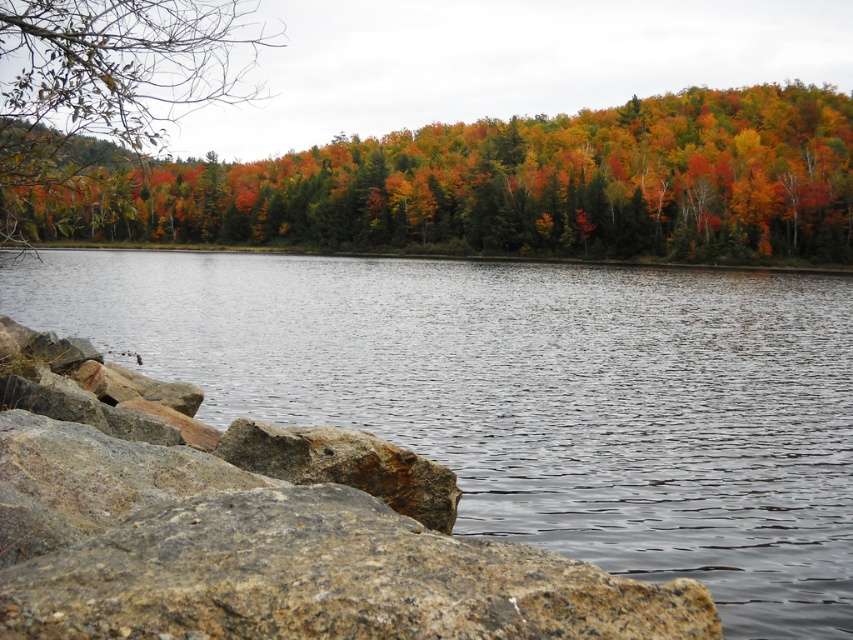
Does point (602, 531) lie in front of point (700, 616)?

No, it is not.

The height and width of the screenshot is (640, 853). Describe the element at coordinates (531, 396) in the screenshot. I see `clear water at center` at that location.

You are a GUI agent. You are given a task and a screenshot of the screen. Output one action in this format:
    pyautogui.click(x=<x>, y=<y>)
    Task: Click on the clear water at center
    This screenshot has width=853, height=640.
    Given the screenshot: What is the action you would take?
    pyautogui.click(x=531, y=396)

Can you confirm if clear water at center is positioned to the left of autumn foliage at upper center?

Correct, you'll find clear water at center to the left of autumn foliage at upper center.

Who is lower down, clear water at center or autumn foliage at upper center?

clear water at center is lower down.

Where is `clear water at center`? clear water at center is located at coordinates (531, 396).

You are a GUI agent. You are given a task and a screenshot of the screen. Output one action in this format:
    pyautogui.click(x=<x>, y=<y>)
    Task: Click on the clear water at center
    
    Given the screenshot: What is the action you would take?
    pyautogui.click(x=531, y=396)

Does clear water at center have a smaller size compared to green matte tree at upper left?

Correct, clear water at center occupies less space than green matte tree at upper left.

Does clear water at center have a lesser width compared to green matte tree at upper left?

No.

What do you see at coordinates (531, 396) in the screenshot? I see `clear water at center` at bounding box center [531, 396].

I want to click on clear water at center, so click(x=531, y=396).